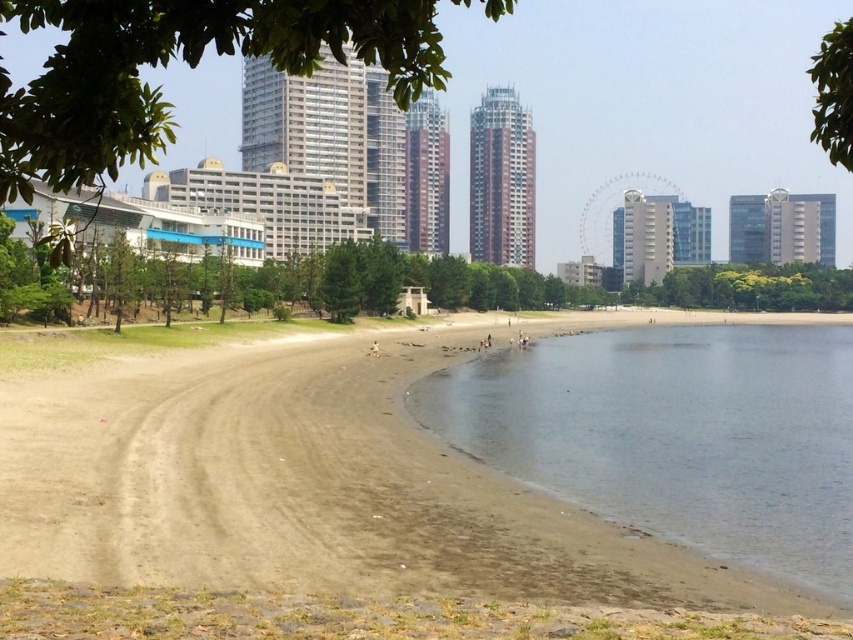
Question: Observing the image, what is the correct spatial positioning of clear water at lower right in reference to green leafy tree at center?

Choices:
 (A) right
 (B) left

Answer: (B)

Question: Based on their relative distances, which object is nearer to the brown sand at lower left?

Choices:
 (A) clear water at lower right
 (B) green leafy tree at center

Answer: (A)

Question: Which object is the closest to the green leafy tree at center?

Choices:
 (A) clear water at lower right
 (B) brown sand at lower left

Answer: (A)

Question: Does clear water at lower right appear under green leafy tree at upper left?

Choices:
 (A) yes
 (B) no

Answer: (A)

Question: Can you confirm if green leafy tree at upper center is thinner than green leafy tree at upper left?

Choices:
 (A) no
 (B) yes

Answer: (B)

Question: Among these objects, which one is nearest to the camera?

Choices:
 (A) brown sand at lower left
 (B) clear water at lower right
 (C) green leafy tree at upper center

Answer: (C)